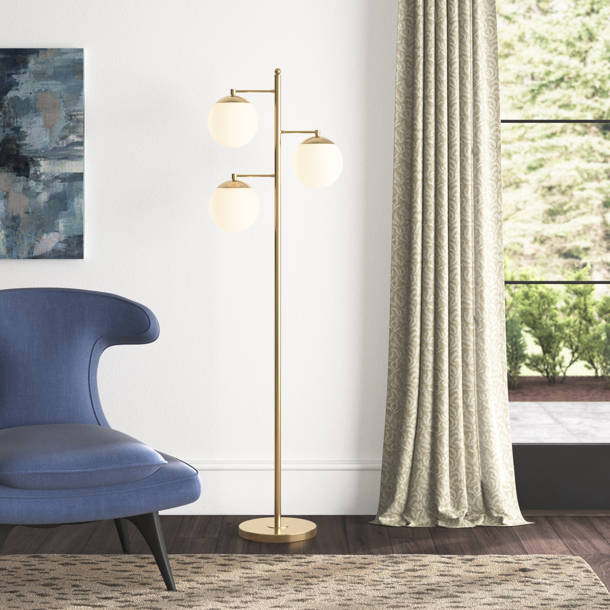
The image size is (610, 610). What are the coordinates of `white light fixture` in the screenshot? It's located at (232, 213).